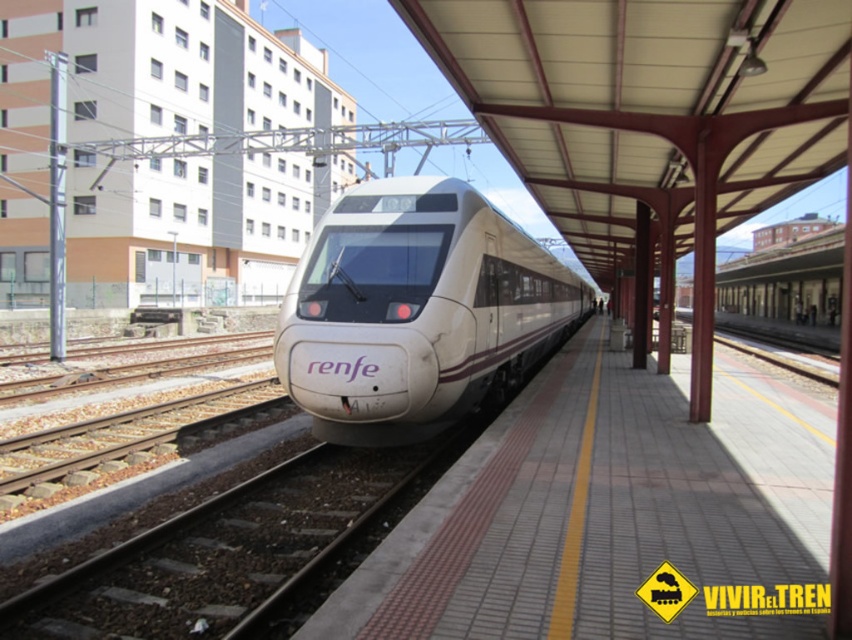
Question: Which of the following is the closest to the observer?

Choices:
 (A) white glossy bullet train at center
 (B) white tile platform at center

Answer: (B)

Question: Does white tile platform at center appear under white glossy bullet train at center?

Choices:
 (A) no
 (B) yes

Answer: (B)

Question: Is white tile platform at center above white glossy bullet train at center?

Choices:
 (A) yes
 (B) no

Answer: (B)

Question: Which point is closer to the camera?

Choices:
 (A) (606, 557)
 (B) (493, 234)

Answer: (A)

Question: Among these objects, which one is nearest to the camera?

Choices:
 (A) white tile platform at center
 (B) white glossy bullet train at center

Answer: (A)

Question: Is white tile platform at center behind white glossy bullet train at center?

Choices:
 (A) yes
 (B) no

Answer: (B)